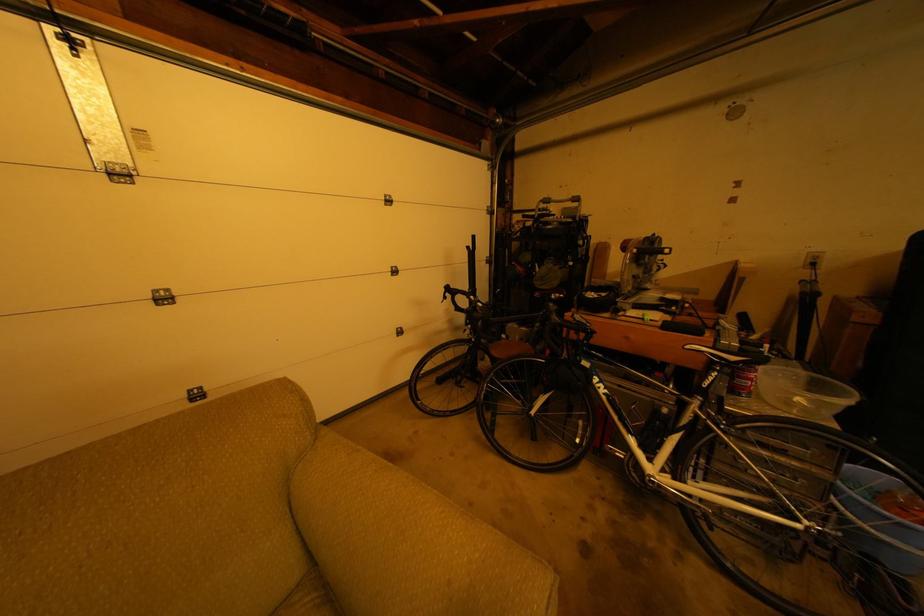
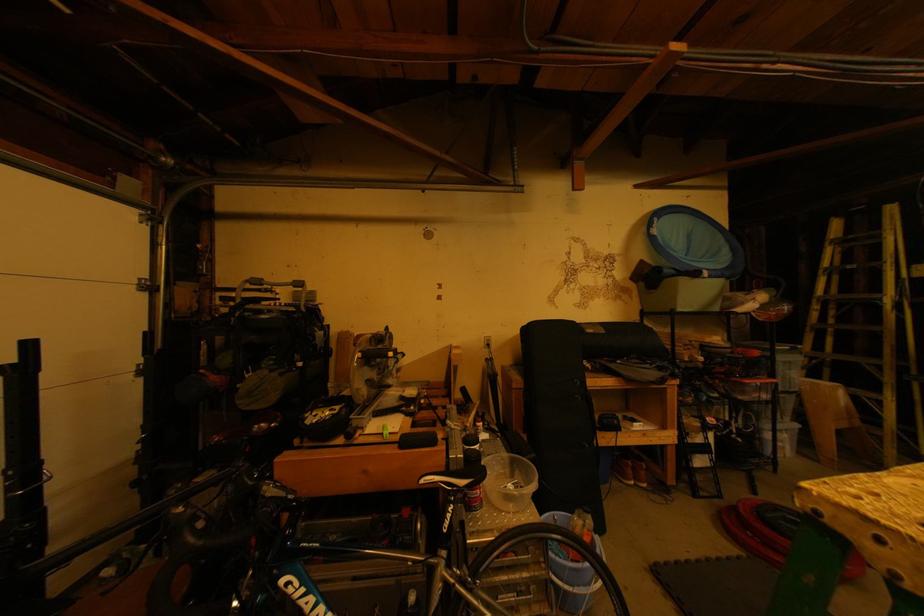
Question: The camera is either moving clockwise (left) or counter-clockwise (right) around the object. The first image is from the beginning of the video and the second image is from the end. Is the camera moving left or right when shooting the video?

Choices:
 (A) Left
 (B) Right

Answer: (A)